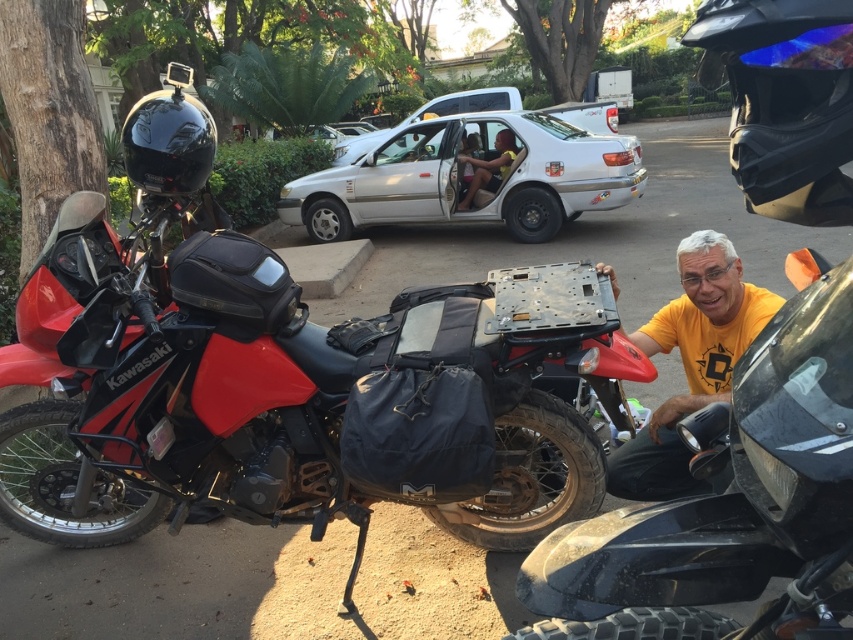
You are a pedestrian standing at the edge of the parking lot. You see the silver metallic car at center and the black glossy helmet at upper left. Which object is positioned higher in the image?

The silver metallic car at center is located above the black glossy helmet at upper left, so it is positioned higher in the image.

You are a delivery person who needs to place a package between the black matte helmet at upper right and the yellow matte shirt at center. Can you fit the package there?

The black matte helmet at upper right is positioned on the left side of yellow matte shirt at center, so there is space between them to place the package.